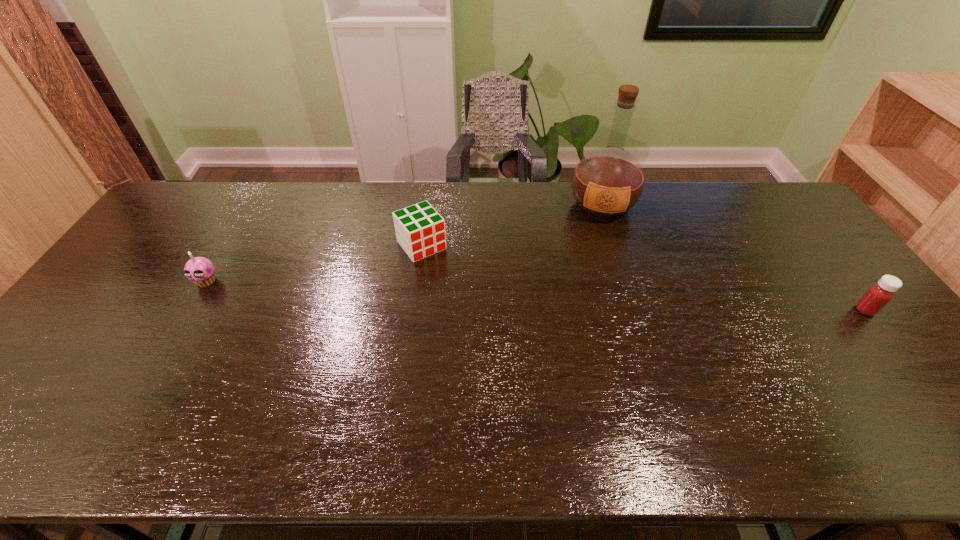
In the image, there is a desktop. Where is `vacant space at the left edge`? The height and width of the screenshot is (540, 960). vacant space at the left edge is located at coordinates (180, 239).

In the image, there is a desktop. Where is `vacant space at the right edge`? vacant space at the right edge is located at coordinates 780,232.

The image size is (960, 540). In the image, there is a desktop. In order to click on blank space at the far left corner in this screenshot , I will do `click(180, 201)`.

Find the location of `free space at the far right corner of the desktop`. free space at the far right corner of the desktop is located at coordinates (730, 182).

The height and width of the screenshot is (540, 960). Identify the location of vacant space in between the nearest object and the cupcake. (536, 295).

Where is `free spot between the third farthest object and the second object from left to right`? The width and height of the screenshot is (960, 540). free spot between the third farthest object and the second object from left to right is located at coordinates (314, 263).

The width and height of the screenshot is (960, 540). I want to click on free space between the nearest object and the liquor, so pos(733,258).

This screenshot has width=960, height=540. I want to click on vacant space in between the third nearest object and the tallest object, so click(x=512, y=225).

Find the location of a particular element. free space between the cube and the nearest object is located at coordinates (643, 278).

The height and width of the screenshot is (540, 960). In order to click on free spot between the leftmost object and the third nearest object in this screenshot , I will do `click(314, 263)`.